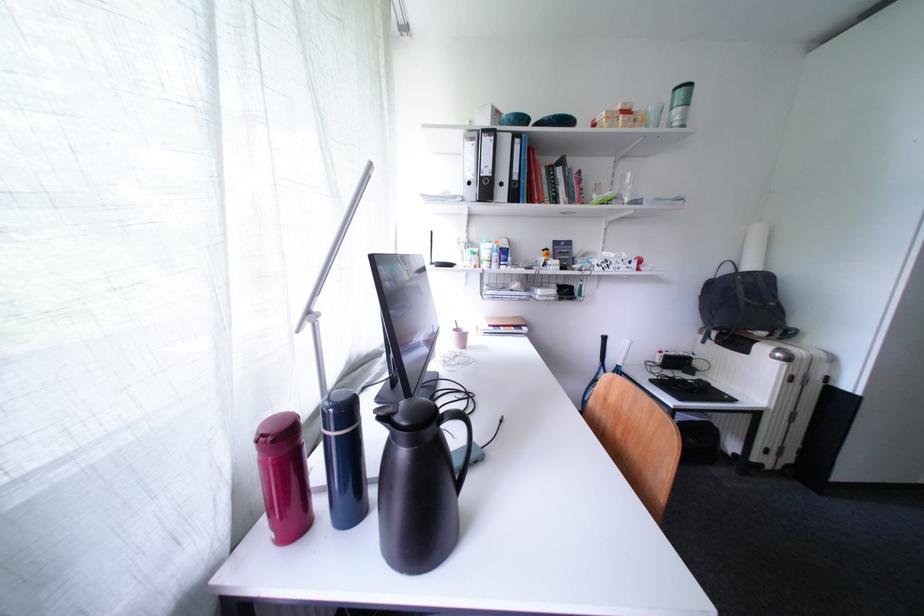
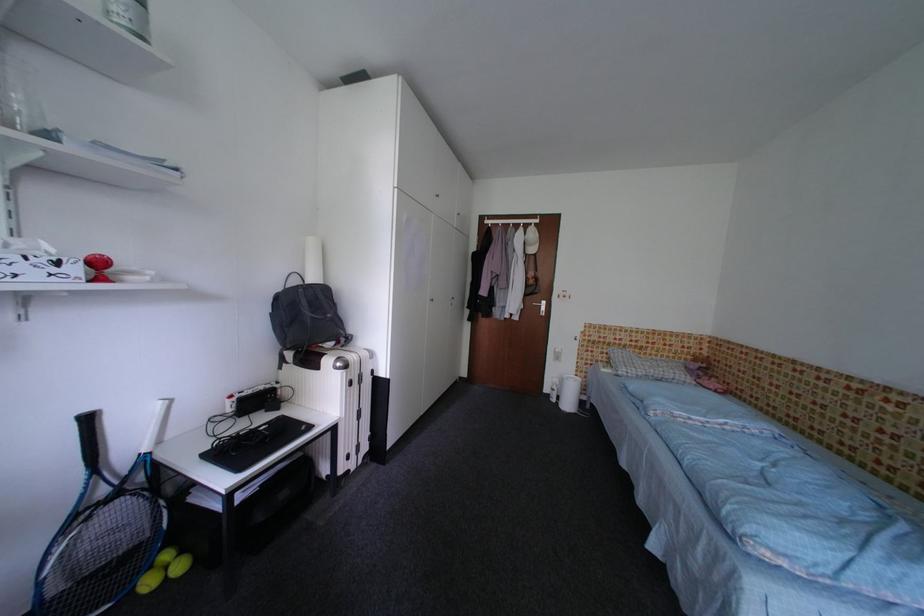
Question: I am providing you with two images of the same scene from different viewpoints. Please identify which objects are invisible in image2.

Choices:
 (A) plaid pillow
 (B) black keyboard
 (C) cabinet door handle
 (D) none of these

Answer: (D)